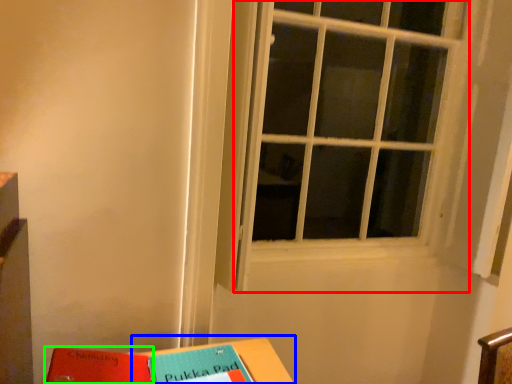
Question: Which object is positioned closest to window (highlighted by a red box)? Select from table (highlighted by a blue box) and paperback book (highlighted by a green box).

Choices:
 (A) table
 (B) paperback book

Answer: (A)